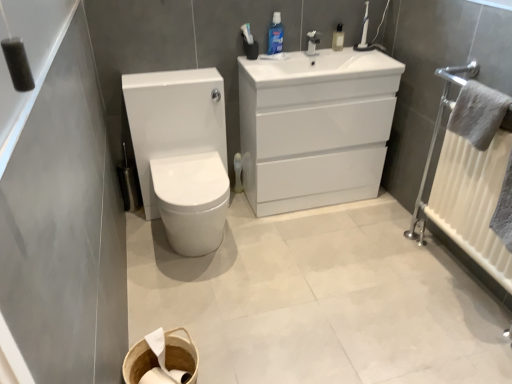
Question: From the image's perspective, would you say white glossy sink at upper center is shown under blue glossy mouthwash at upper center, the 2th mouthwash positioned from the right?

Choices:
 (A) yes
 (B) no

Answer: (A)

Question: Considering the relative sizes of white glossy sink at upper center and blue glossy mouthwash at upper center, which appears as the first mouthwash when viewed from the left, in the image provided, is white glossy sink at upper center shorter than blue glossy mouthwash at upper center, which appears as the first mouthwash when viewed from the left,?

Choices:
 (A) no
 (B) yes

Answer: (B)

Question: Can you confirm if white glossy sink at upper center is taller than blue glossy mouthwash at upper center, which appears as the first mouthwash when viewed from the left?

Choices:
 (A) no
 (B) yes

Answer: (A)

Question: Considering the relative sizes of white glossy sink at upper center and blue glossy mouthwash at upper center, which appears as the first mouthwash when viewed from the left, in the image provided, is white glossy sink at upper center thinner than blue glossy mouthwash at upper center, which appears as the first mouthwash when viewed from the left,?

Choices:
 (A) yes
 (B) no

Answer: (B)

Question: Does white glossy sink at upper center lie behind blue glossy mouthwash at upper center, the 2th mouthwash positioned from the right?

Choices:
 (A) yes
 (B) no

Answer: (B)

Question: Visually, is white woven basket at lower center positioned to the left or to the right of white glossy cabinet at upper center?

Choices:
 (A) right
 (B) left

Answer: (B)

Question: From the image's perspective, is white woven basket at lower center positioned above or below white glossy cabinet at upper center?

Choices:
 (A) above
 (B) below

Answer: (B)

Question: Based on their sizes in the image, would you say white woven basket at lower center is bigger or smaller than white glossy cabinet at upper center?

Choices:
 (A) big
 (B) small

Answer: (B)

Question: Considering their positions, is white woven basket at lower center located in front of or behind white glossy cabinet at upper center?

Choices:
 (A) behind
 (B) front

Answer: (B)

Question: In terms of size, does white glossy sink at upper center appear bigger or smaller than matte white faucet at upper center?

Choices:
 (A) big
 (B) small

Answer: (A)

Question: Is white glossy sink at upper center taller or shorter than matte white faucet at upper center?

Choices:
 (A) tall
 (B) short

Answer: (A)

Question: Considering the positions of point tap(294, 81) and point tap(313, 31), is point tap(294, 81) closer or farther from the camera than point tap(313, 31)?

Choices:
 (A) closer
 (B) farther

Answer: (A)

Question: From the image's perspective, relative to matte white faucet at upper center, is white glossy sink at upper center above or below?

Choices:
 (A) above
 (B) below

Answer: (B)

Question: In terms of size, does white plastic radiator at right appear bigger or smaller than white glossy sink at upper center?

Choices:
 (A) big
 (B) small

Answer: (A)

Question: From their relative heights in the image, would you say white plastic radiator at right is taller or shorter than white glossy sink at upper center?

Choices:
 (A) short
 (B) tall

Answer: (B)